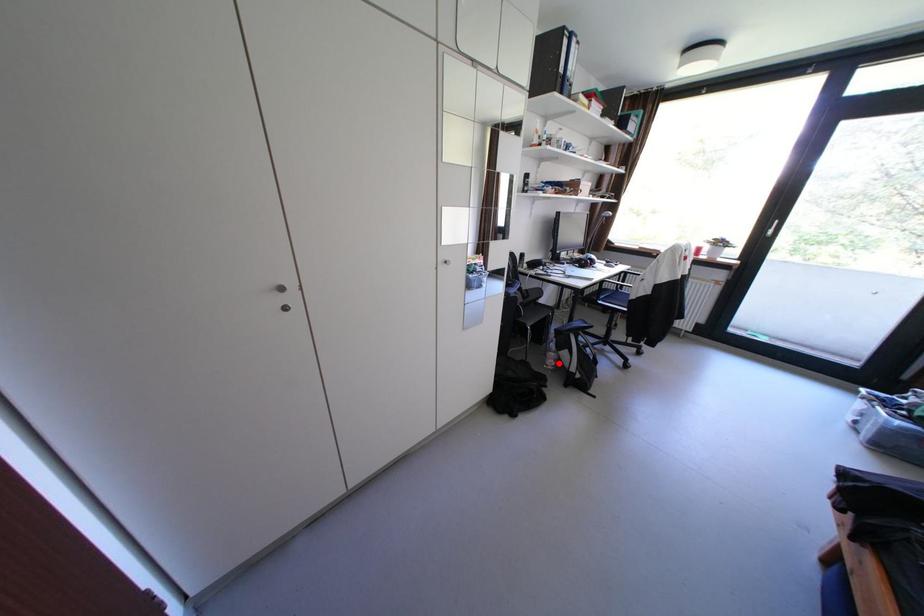
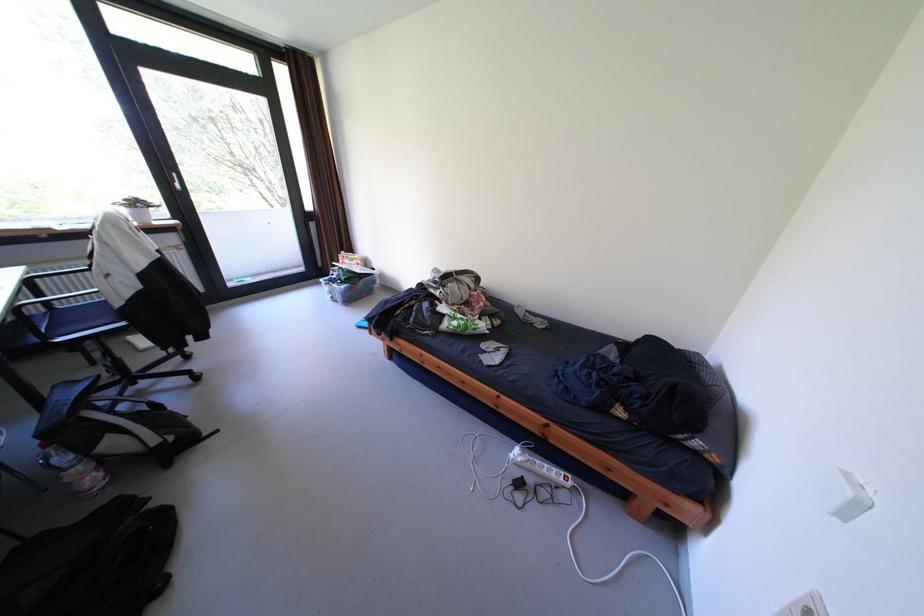
Question: A red point is marked in image1. In image2, is the corresponding 3D point closer to the camera or farther? Reply with the corresponding letter.

Choices:
 (A) The corresponding 3D point is closer.
 (B) The corresponding 3D point is farther.

Answer: (B)